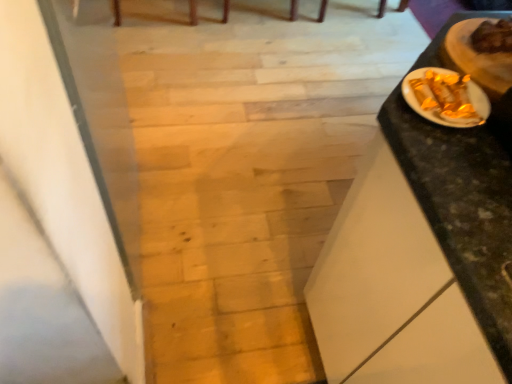
Describe the element at coordinates (247, 170) in the screenshot. I see `wooden floor at center` at that location.

Identify the location of gold foil candy at right, the first food from the bottom. (444, 98).

Where is `golden foil-wrapped food at upper right, which is counted as the 1th food, starting from the right`? golden foil-wrapped food at upper right, which is counted as the 1th food, starting from the right is located at coordinates (478, 57).

Is black marble table at right looking in the opposite direction of golden foil-wrapped food at upper right, which is counted as the 1th food, starting from the right?

No, golden foil-wrapped food at upper right, which is counted as the 1th food, starting from the right, is not at the back of black marble table at right.

Are black marble table at right and golden foil-wrapped food at upper right, which is counted as the 1th food, starting from the right, far apart?

No, there isn't a large distance between black marble table at right and golden foil-wrapped food at upper right, which is counted as the 1th food, starting from the right.

Does black marble table at right have a greater width compared to golden foil-wrapped food at upper right, the second food positioned from the left?

Indeed, black marble table at right has a greater width compared to golden foil-wrapped food at upper right, the second food positioned from the left.

Is black marble table at right surrounding golden foil-wrapped food at upper right, which is counted as the 1th food, starting from the right?

No, golden foil-wrapped food at upper right, which is counted as the 1th food, starting from the right, is located outside of black marble table at right.

Which is in front, point (505, 70) or point (243, 117)?

The point (505, 70) is in front.

Where is `stairwell that is on the left side of gold foil wrapped food at right`? The height and width of the screenshot is (384, 512). stairwell that is on the left side of gold foil wrapped food at right is located at coordinates (247, 170).

Choose the correct answer: Is gold foil wrapped food at right inside wooden floor at center or outside it?

gold foil wrapped food at right is not enclosed by wooden floor at center.

Who is taller, gold foil wrapped food at right or wooden floor at center?

wooden floor at center.

From a real-world perspective, between gold foil candy at right, the first food from the bottom, and gold foil wrapped food at right, who is vertically lower?

gold foil wrapped food at right is physically lower.

Is gold foil candy at right, marked as the 2th food in a top-to-bottom arrangement, looking in the opposite direction of gold foil wrapped food at right?

No, gold foil candy at right, marked as the 2th food in a top-to-bottom arrangement,'s orientation is not away from gold foil wrapped food at right.

From the image's perspective, does gold foil candy at right, marked as the 2th food in a top-to-bottom arrangement, appear lower than gold foil wrapped food at right?

Indeed, from the image's perspective, gold foil candy at right, marked as the 2th food in a top-to-bottom arrangement, is shown beneath gold foil wrapped food at right.

In terms of width, does gold foil wrapped food at right look wider or thinner when compared to black marble table at right?

Clearly, gold foil wrapped food at right has less width compared to black marble table at right.

Is gold foil wrapped food at right oriented towards black marble table at right?

No, gold foil wrapped food at right is not turned towards black marble table at right.

How different are the orientations of gold foil wrapped food at right and black marble table at right in degrees?

gold foil wrapped food at right and black marble table at right are facing 2.09 degrees away from each other.

From the image's perspective, which is below, gold foil wrapped food at right or black marble table at right?

black marble table at right is shown below in the image.

Is wooden floor at center not inside gold foil candy at right, which ranks as the 1th food in left-to-right order?

Yes, wooden floor at center is not within gold foil candy at right, which ranks as the 1th food in left-to-right order.

Can you confirm if wooden floor at center is wider than gold foil candy at right, which is counted as the 2th food, starting from the right?

Indeed, wooden floor at center has a greater width compared to gold foil candy at right, which is counted as the 2th food, starting from the right.

Is wooden floor at center at the right side of gold foil candy at right, which is counted as the 2th food, starting from the right?

Yes.

From a real-world perspective, is wooden floor at center located higher than gold foil candy at right, marked as the 2th food in a top-to-bottom arrangement?

Actually, wooden floor at center is physically below gold foil candy at right, marked as the 2th food in a top-to-bottom arrangement, in the real world.

From the image's perspective, between gold foil candy at right, marked as the 2th food in a top-to-bottom arrangement, and black marble table at right, who is located below?

black marble table at right, from the image's perspective.

In the image, is gold foil candy at right, which is counted as the 2th food, starting from the right, on the left side or the right side of black marble table at right?

From the image, it's evident that gold foil candy at right, which is counted as the 2th food, starting from the right, is to the left of black marble table at right.

Considering the positions of objects gold foil candy at right, the first food from the bottom, and black marble table at right in the image provided, who is in front, gold foil candy at right, the first food from the bottom, or black marble table at right?

black marble table at right.

From the image's perspective, which one is positioned lower, wooden floor at center or gold foil wrapped food at right?

gold foil wrapped food at right appears lower in the image.

Looking at this image, is wooden floor at center directly adjacent to gold foil wrapped food at right?

No, wooden floor at center is not beside gold foil wrapped food at right.

Does wooden floor at center have a larger size compared to gold foil wrapped food at right?

Correct, wooden floor at center is larger in size than gold foil wrapped food at right.

At what (x,y) coordinates should I click in order to perform the action: click on the 2nd food behind when counting from the black marble table at right. Please return your answer as a coordinate pair (x, y). The image size is (512, 384). Looking at the image, I should click on (478, 57).

Image resolution: width=512 pixels, height=384 pixels. What are the coordinates of `dinner located on the right of wooden floor at center` in the screenshot? It's located at (466, 73).

Looking at the image, which one is located further to gold foil candy at right, which ranks as the 1th food in left-to-right order, black marble table at right or wooden floor at center?

wooden floor at center is further to gold foil candy at right, which ranks as the 1th food in left-to-right order.

From the image, which object appears to be nearer to wooden floor at center, black marble table at right or gold foil candy at right, the first food from the bottom?

The object closer to wooden floor at center is black marble table at right.

When comparing their distances from black marble table at right, does wooden floor at center or golden foil-wrapped food at upper right, acting as the first food starting from the top, seem further?

wooden floor at center is further to black marble table at right.

Looking at the image, which one is located further to golden foil-wrapped food at upper right, which is counted as the 1th food, starting from the right, gold foil candy at right, which is counted as the 2th food, starting from the right, or wooden floor at center?

Based on the image, wooden floor at center appears to be further to golden foil-wrapped food at upper right, which is counted as the 1th food, starting from the right.

Based on their spatial positions, is golden foil-wrapped food at upper right, which is counted as the 1th food, starting from the right, or gold foil candy at right, which ranks as the 1th food in left-to-right order, closer to black marble table at right?

gold foil candy at right, which ranks as the 1th food in left-to-right order, is closer to black marble table at right.

Considering their positions, is gold foil candy at right, the first food from the bottom, positioned closer to gold foil wrapped food at right than black marble table at right?

gold foil candy at right, the first food from the bottom, lies closer to gold foil wrapped food at right than the other object.

Based on their spatial positions, is gold foil wrapped food at right or gold foil candy at right, marked as the 2th food in a top-to-bottom arrangement, further from golden foil-wrapped food at upper right, placed as the second food when sorted from bottom to top?

Based on the image, gold foil candy at right, marked as the 2th food in a top-to-bottom arrangement, appears to be further to golden foil-wrapped food at upper right, placed as the second food when sorted from bottom to top.

Based on the photo, considering their positions, is golden foil-wrapped food at upper right, which is counted as the 1th food, starting from the right, positioned further to gold foil candy at right, marked as the 2th food in a top-to-bottom arrangement, than wooden floor at center?

The object further to gold foil candy at right, marked as the 2th food in a top-to-bottom arrangement, is wooden floor at center.

Locate an element on the screen. This screenshot has width=512, height=384. dinner between golden foil-wrapped food at upper right, the second food positioned from the left, and black marble table at right, in the vertical direction is located at coordinates (466, 73).

This screenshot has height=384, width=512. I want to click on dinner located between gold foil candy at right, marked as the 2th food in a top-to-bottom arrangement, and wooden floor at center in the depth direction, so [x=466, y=73].

Image resolution: width=512 pixels, height=384 pixels. Identify the location of food located between gold foil wrapped food at right and wooden floor at center in the depth direction. (478, 57).

Find the location of `dinner between gold foil candy at right, marked as the 2th food in a top-to-bottom arrangement, and black marble table at right, in the horizontal direction`. dinner between gold foil candy at right, marked as the 2th food in a top-to-bottom arrangement, and black marble table at right, in the horizontal direction is located at coordinates (466, 73).